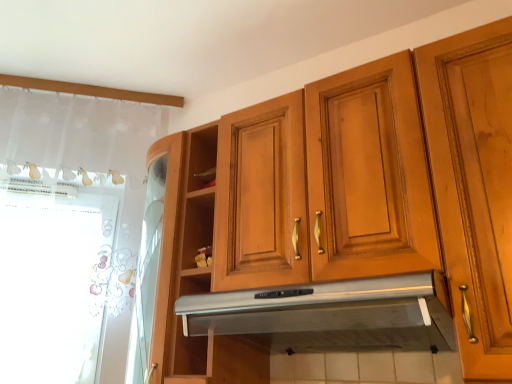
The image size is (512, 384). I want to click on wooden cabinet at upper center, so click(346, 207).

The width and height of the screenshot is (512, 384). Describe the element at coordinates (54, 278) in the screenshot. I see `white lace curtain at left` at that location.

The height and width of the screenshot is (384, 512). Find the location of `wooden cabinet at upper center`. wooden cabinet at upper center is located at coordinates (346, 207).

Are wooden cabinet at upper center and silver metallic exhaust hood at center located far from each other?

Answer: No.

Considering the sizes of wooden cabinet at upper center and silver metallic exhaust hood at center in the image, is wooden cabinet at upper center bigger or smaller than silver metallic exhaust hood at center?

In the image, wooden cabinet at upper center appears to be larger than silver metallic exhaust hood at center.

Does wooden cabinet at upper center come in front of silver metallic exhaust hood at center?

Yes, the depth of wooden cabinet at upper center is less than that of silver metallic exhaust hood at center.

How distant is wooden cabinet at upper center from silver metallic exhaust hood at center?

A distance of 6.49 inches exists between wooden cabinet at upper center and silver metallic exhaust hood at center.

In the scene shown: From the image's perspective, which object appears higher, wooden cabinet at upper center or white lace curtain at left?

wooden cabinet at upper center.

Image resolution: width=512 pixels, height=384 pixels. Find the location of `cabinetry that appears on the right of white lace curtain at left`. cabinetry that appears on the right of white lace curtain at left is located at coordinates [x=346, y=207].

Would you say white lace curtain at left is part of wooden cabinet at upper center's contents?

No.

From a real-world perspective, relative to white lace curtain at left, is wooden cabinet at upper center vertically above or below?

wooden cabinet at upper center is above white lace curtain at left.

Who is smaller, white lace curtain at left or silver metallic exhaust hood at center?

Smaller between the two is white lace curtain at left.

Can you confirm if white lace curtain at left is positioned to the right of silver metallic exhaust hood at center?

In fact, white lace curtain at left is to the left of silver metallic exhaust hood at center.

Would you say white lace curtain at left is inside or outside silver metallic exhaust hood at center?

white lace curtain at left cannot be found inside silver metallic exhaust hood at center.

Looking at this image, in the image, is silver metallic exhaust hood at center on the left side or the right side of white lace curtain at left?

silver metallic exhaust hood at center is positioned on white lace curtain at left's right side.

Considering the sizes of objects silver metallic exhaust hood at center and white lace curtain at left in the image provided, who is wider, silver metallic exhaust hood at center or white lace curtain at left?

With larger width is silver metallic exhaust hood at center.

Which point is more forward, (382, 347) or (98, 188)?

The point (382, 347) is closer.

Does silver metallic exhaust hood at center lie behind white lace curtain at left?

No, silver metallic exhaust hood at center is closer to the camera.

Is point (106, 187) closer or farther from the camera than point (421, 236)?

Clearly, point (106, 187) is more distant from the camera than point (421, 236).

From the image's perspective, is white lace curtain at left below wooden cabinet at upper center?

Correct, white lace curtain at left appears lower than wooden cabinet at upper center in the image.

Can you see white lace curtain at left touching wooden cabinet at upper center?

No, white lace curtain at left is not in contact with wooden cabinet at upper center.

Which object is closer to the camera, white lace curtain at left or wooden cabinet at upper center?

Positioned in front is wooden cabinet at upper center.

Image resolution: width=512 pixels, height=384 pixels. In order to click on exhaust hood on the right of wooden cabinet at upper center in this screenshot , I will do `click(332, 314)`.

Is silver metallic exhaust hood at center facing towards wooden cabinet at upper center?

Yes, silver metallic exhaust hood at center faces towards wooden cabinet at upper center.

From a real-world perspective, which object rests below the other?

From a 3D spatial view, silver metallic exhaust hood at center is below.

Considering the sizes of objects silver metallic exhaust hood at center and wooden cabinet at upper center in the image provided, who is bigger, silver metallic exhaust hood at center or wooden cabinet at upper center?

wooden cabinet at upper center.

You are a GUI agent. You are given a task and a screenshot of the screen. Output one action in this format:
    pyautogui.click(x=<x>, y=<y>)
    Task: Click on the cabinetry above the silver metallic exhaust hood at center (from the image's perspective)
    The height and width of the screenshot is (384, 512).
    Given the screenshot: What is the action you would take?
    pyautogui.click(x=346, y=207)

Locate an element on the screen. window screen behind the wooden cabinet at upper center is located at coordinates (54, 278).

When comparing their distances from silver metallic exhaust hood at center, does white lace curtain at left or wooden cabinet at upper center seem closer?

Among the two, wooden cabinet at upper center is located nearer to silver metallic exhaust hood at center.

Which object lies further to the anchor point white lace curtain at left, wooden cabinet at upper center or silver metallic exhaust hood at center?

Based on the image, silver metallic exhaust hood at center appears to be further to white lace curtain at left.

Looking at the image, which one is located further to silver metallic exhaust hood at center, wooden cabinet at upper center or white lace curtain at left?

white lace curtain at left lies further to silver metallic exhaust hood at center than the other object.

Looking at this image, based on their spatial positions, is white lace curtain at left or silver metallic exhaust hood at center closer to wooden cabinet at upper center?

silver metallic exhaust hood at center is closer to wooden cabinet at upper center.

Based on the photo, considering their positions, is silver metallic exhaust hood at center positioned closer to wooden cabinet at upper center than white lace curtain at left?

silver metallic exhaust hood at center lies closer to wooden cabinet at upper center than the other object.

From the image, which object appears to be farther from white lace curtain at left, silver metallic exhaust hood at center or wooden cabinet at upper center?

silver metallic exhaust hood at center is further to white lace curtain at left.

You are a GUI agent. You are given a task and a screenshot of the screen. Output one action in this format:
    pyautogui.click(x=<x>, y=<y>)
    Task: Click on the cabinetry between white lace curtain at left and silver metallic exhaust hood at center in the horizontal direction
    
    Given the screenshot: What is the action you would take?
    pyautogui.click(x=346, y=207)